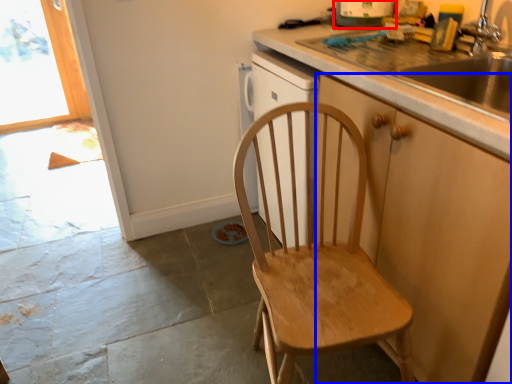
Question: Which of the following is the closest to the observer, kitchen appliance (highlighted by a red box) or cabinetry (highlighted by a blue box)?

Choices:
 (A) kitchen appliance
 (B) cabinetry

Answer: (B)